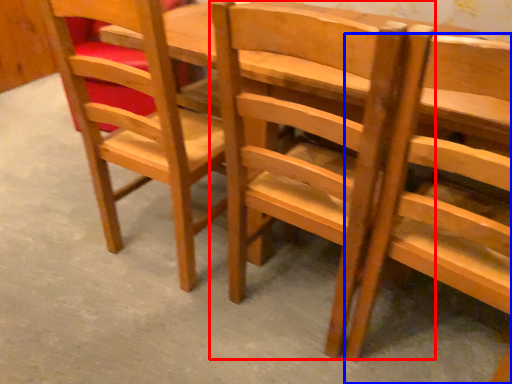
Question: Which of the following is the closest to the observer, chair (highlighted by a red box) or chair (highlighted by a blue box)?

Choices:
 (A) chair
 (B) chair

Answer: (B)